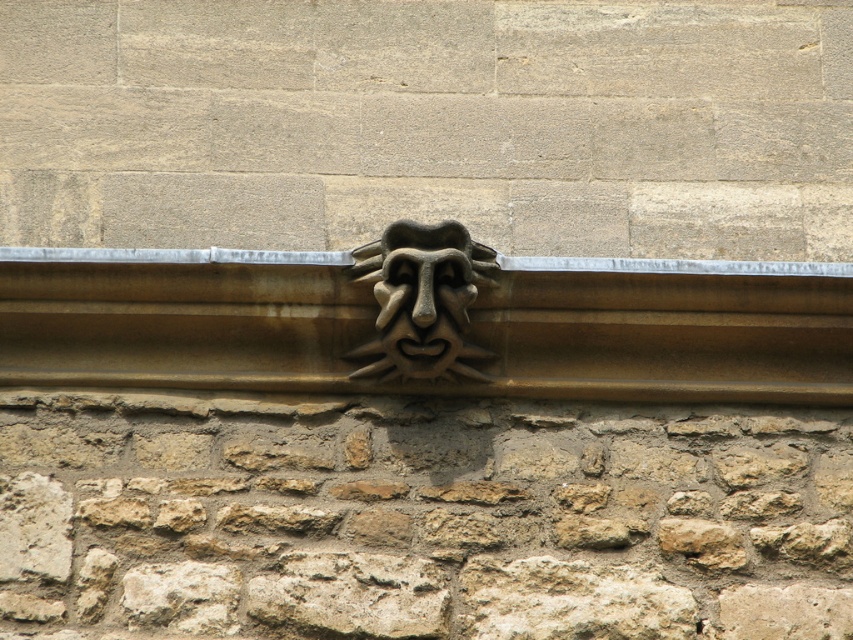
Question: Does brown rough stone at center have a smaller size compared to brown stone ledge at center?

Choices:
 (A) no
 (B) yes

Answer: (A)

Question: Estimate the real-world distances between objects in this image. Which object is closer to the brown stone ledge at center?

Choices:
 (A) brown rough stone at center
 (B) brown stone mask at center

Answer: (B)

Question: Based on their relative distances, which object is farther from the brown rough stone at center?

Choices:
 (A) brown stone mask at center
 (B) brown stone ledge at center

Answer: (A)

Question: Which of the following is the farthest from the observer?

Choices:
 (A) brown rough stone at center
 (B) brown stone mask at center

Answer: (B)

Question: Where is brown stone ledge at center located in relation to brown stone mask at center in the image?

Choices:
 (A) left
 (B) right

Answer: (B)

Question: Does brown rough stone at center have a lesser width compared to brown stone ledge at center?

Choices:
 (A) no
 (B) yes

Answer: (B)